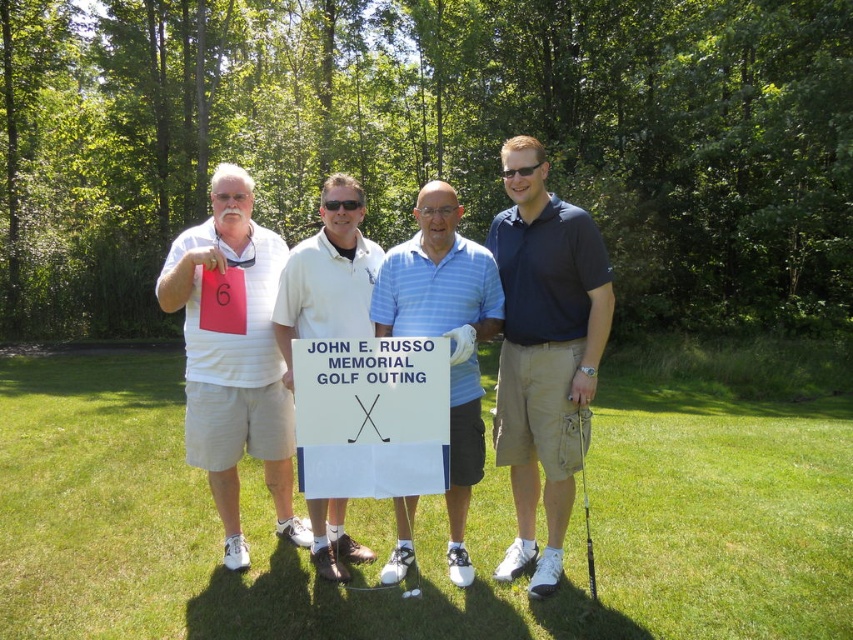
Is green grass at center closer to the viewer compared to white cotton polo shirt at center?

Yes, it is in front of white cotton polo shirt at center.

Can you confirm if green grass at center is thinner than white cotton polo shirt at center?

No.

Is point (302, 586) positioned before point (341, 563)?

That is True.

Where is `green grass at center`? The width and height of the screenshot is (853, 640). green grass at center is located at coordinates (424, 522).

How far apart are green grass at center and metallic silver golf club at lower center?

They are 11.40 feet apart.

Describe the element at coordinates (424, 522) in the screenshot. The height and width of the screenshot is (640, 853). I see `green grass at center` at that location.

Identify the location of green grass at center. This screenshot has width=853, height=640. (424, 522).

Can you confirm if blue striped polo shirt at center is shorter than metallic silver golf club at lower center?

Incorrect, blue striped polo shirt at center's height does not fall short of metallic silver golf club at lower center's.

Find the location of a particular element. The image size is (853, 640). blue striped polo shirt at center is located at coordinates (445, 333).